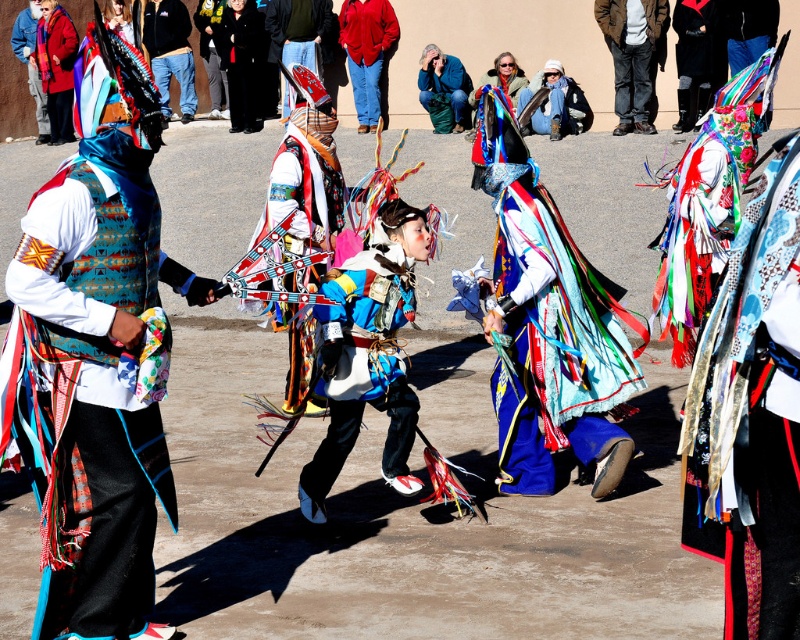
Can you confirm if red fuzzy coat at upper left is positioned to the left of matte black shoes at center?

Indeed, red fuzzy coat at upper left is positioned on the left side of matte black shoes at center.

Who is lower down, red fuzzy coat at upper left or matte black shoes at center?

red fuzzy coat at upper left is lower down.

Between point (46, 92) and point (322, 12), which one is positioned behind?

Positioned behind is point (46, 92).

I want to click on red fuzzy coat at upper left, so click(56, 67).

Is black wool coat at center closer to camera compared to blue denim jacket at upper center?

No.

Can you confirm if black wool coat at center is shorter than blue denim jacket at upper center?

No.

Where is `black wool coat at center`? black wool coat at center is located at coordinates (240, 60).

Does multicolored fabric costume at center have a lesser height compared to black wool coat at center?

Yes, multicolored fabric costume at center is shorter than black wool coat at center.

Does multicolored fabric costume at center have a lesser width compared to black wool coat at center?

Correct, multicolored fabric costume at center's width is less than black wool coat at center's.

What are the coordinates of `multicolored fabric costume at center` in the screenshot? It's located at (368, 365).